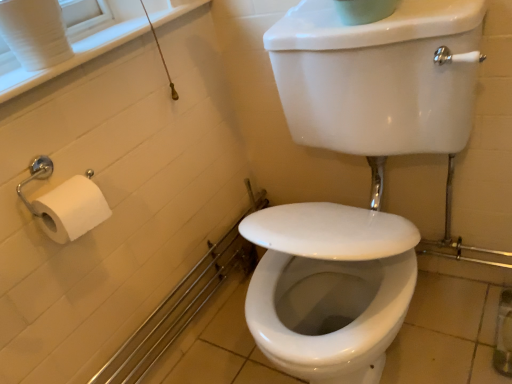
This screenshot has width=512, height=384. Find the location of `white glossy sink at upper center`. white glossy sink at upper center is located at coordinates (372, 178).

The height and width of the screenshot is (384, 512). What do you see at coordinates (372, 178) in the screenshot? I see `white glossy sink at upper center` at bounding box center [372, 178].

Locate an element on the screen. Image resolution: width=512 pixels, height=384 pixels. white glossy sink at upper center is located at coordinates (372, 178).